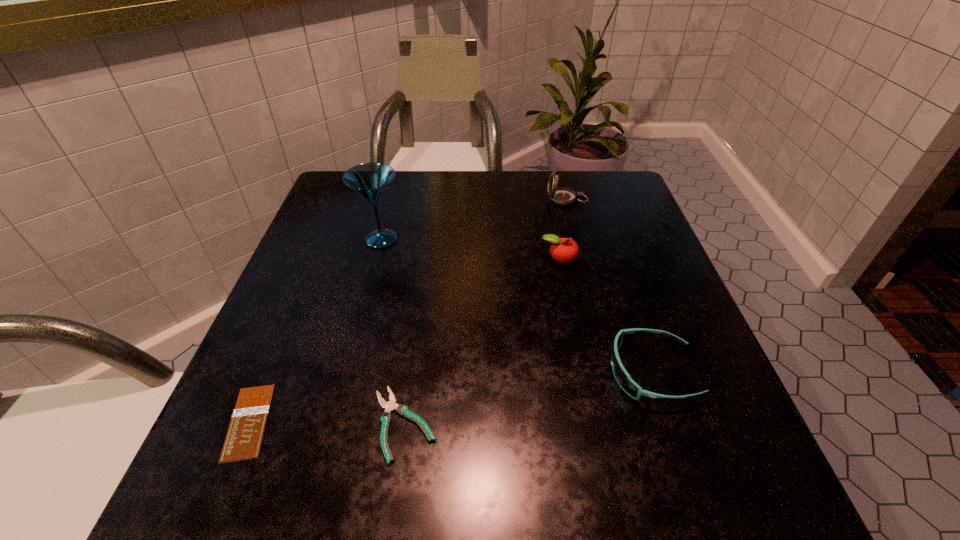
The image size is (960, 540). In order to click on object present at the far edge in this screenshot , I will do `click(561, 196)`.

Locate an element on the screen. The image size is (960, 540). pliers at the near edge is located at coordinates (386, 418).

What are the coordinates of `chocolate bar present at the near edge` in the screenshot? It's located at (243, 441).

The height and width of the screenshot is (540, 960). I want to click on martini that is at the left edge, so click(x=370, y=180).

You are a GUI agent. You are given a task and a screenshot of the screen. Output one action in this format:
    pyautogui.click(x=<x>, y=<y>)
    Task: Click on the chocolate bar present at the left edge
    
    Given the screenshot: What is the action you would take?
    pyautogui.click(x=243, y=441)

This screenshot has width=960, height=540. What are the coordinates of `compass that is at the right edge` in the screenshot? It's located at (561, 196).

Find the location of a particular element. This screenshot has height=540, width=960. sunglasses positioned at the right edge is located at coordinates click(x=622, y=377).

Where is `object at the near left corner`? object at the near left corner is located at coordinates (243, 441).

Find the location of `object situated at the far right corner`. object situated at the far right corner is located at coordinates (561, 196).

Locate an element on the screen. free spot at the far edge of the desktop is located at coordinates (518, 172).